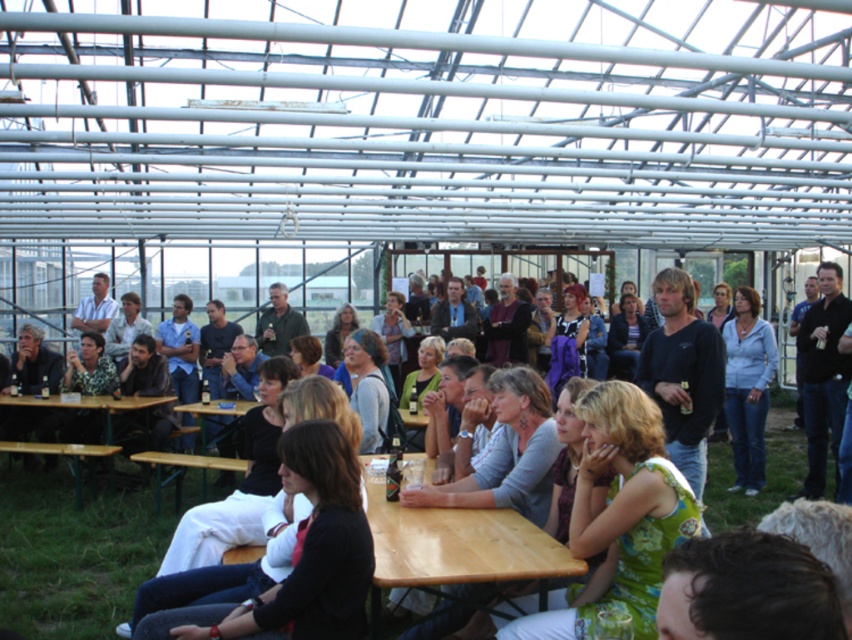
Question: Which point appears closest to the camera in this image?

Choices:
 (A) (400, 572)
 (B) (113, 397)

Answer: (A)

Question: Which object appears closest to the camera in this image?

Choices:
 (A) wooden table at center
 (B) wooden picnic table at lower left

Answer: (A)

Question: Does wooden table at center have a lesser width compared to wooden picnic table at lower left?

Choices:
 (A) no
 (B) yes

Answer: (B)

Question: Is wooden table at center behind wooden picnic table at lower left?

Choices:
 (A) yes
 (B) no

Answer: (B)

Question: Can you confirm if wooden table at center is positioned to the left of wooden picnic table at lower left?

Choices:
 (A) yes
 (B) no

Answer: (B)